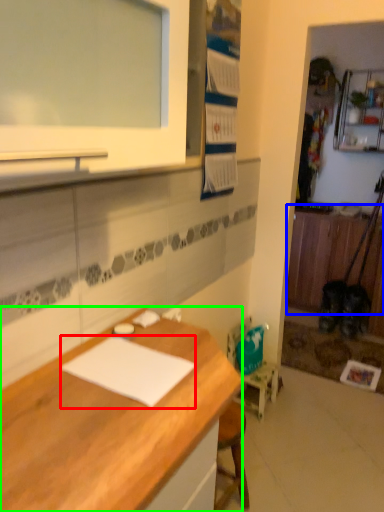
Question: Which object is the closest to the notepad (highlighted by a red box)? Choose among these: cabinetry (highlighted by a blue box) or desk (highlighted by a green box).

Choices:
 (A) cabinetry
 (B) desk

Answer: (B)